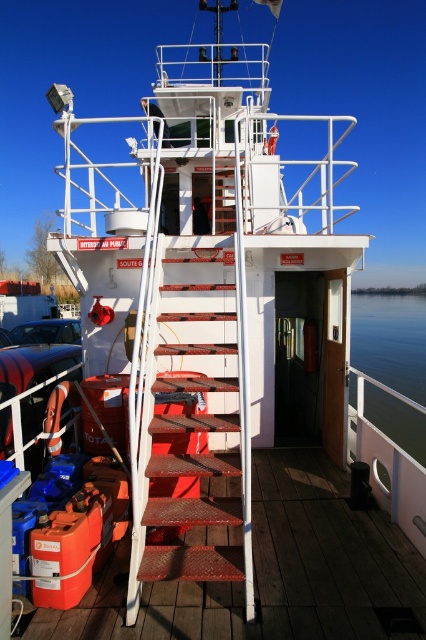
You are standing on the boat and want to move from the red metal stairs at center to the green water at lower right. Which direction should you move in?

You should move to the right to reach the green water at lower right from the red metal stairs at center because the red metal stairs at center is to the left of green water at lower right.

You are standing on the upper deck of the boat and want to go down to the lower deck. Which object at point (273, 572) should you use?

The red metal stairs at center located at point (273, 572) are the correct path to descend to the lower deck.